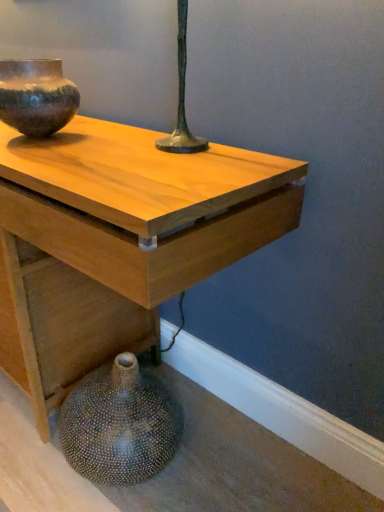
Question: From a real-world perspective, is speckled ceramic vase at lower left, which is the 2th vase from top to bottom, positioned above or below light wood table at center?

Choices:
 (A) below
 (B) above

Answer: (A)

Question: Considering the positions of speckled ceramic vase at lower left, the first vase when ordered from bottom to top, and light wood table at center in the image, is speckled ceramic vase at lower left, the first vase when ordered from bottom to top, wider or thinner than light wood table at center?

Choices:
 (A) wide
 (B) thin

Answer: (B)

Question: Which object is positioned closest to the light wood table at center?

Choices:
 (A) speckled ceramic vase at lower left, the first vase when ordered from bottom to top
 (B) rustic ceramic vase at upper left, marked as the second vase in a bottom-to-top arrangement

Answer: (A)

Question: Which is farther from the light wood table at center?

Choices:
 (A) rustic ceramic vase at upper left, positioned as the 1th vase in top-to-bottom order
 (B) speckled ceramic vase at lower left, the first vase when ordered from bottom to top

Answer: (A)